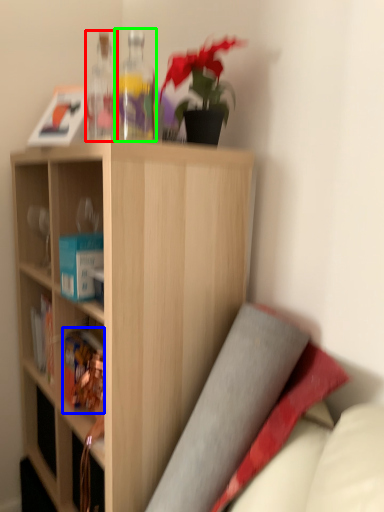
Question: Which object is the farthest from bottle (highlighted by a red box)? Choose among these: book (highlighted by a blue box) or bottle (highlighted by a green box).

Choices:
 (A) book
 (B) bottle

Answer: (A)